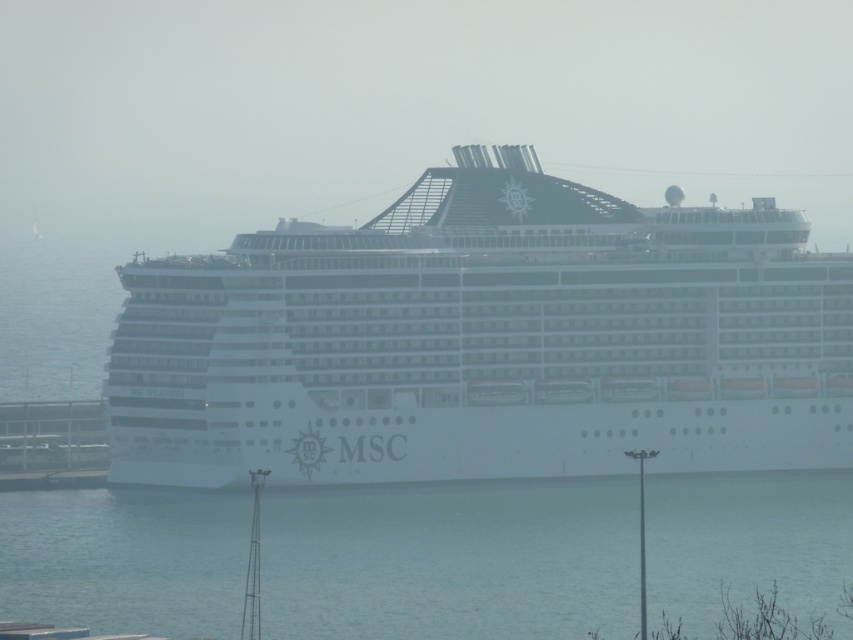
You are a marine biologist who needs to collect water samples from the clear blue water at lower center. Your boat can only approach within 30 meters of the white matte cruise ship at center. Can you safely collect the samples without getting too close to the ship?

The distance between the white matte cruise ship at center and the clear blue water at lower center is 25.75 meters, which is within the 30 meters safety limit. Therefore, you can safely collect the samples without getting too close to the ship.

Based on the photo, you are a photographer planning to capture the white matte cruise ship at center and the clear blue water at lower center in a single shot. Considering their sizes, which object will occupy more space in your photo?

The white matte cruise ship at center is larger in size than the clear blue water at lower center, so it will occupy more space in the photo.